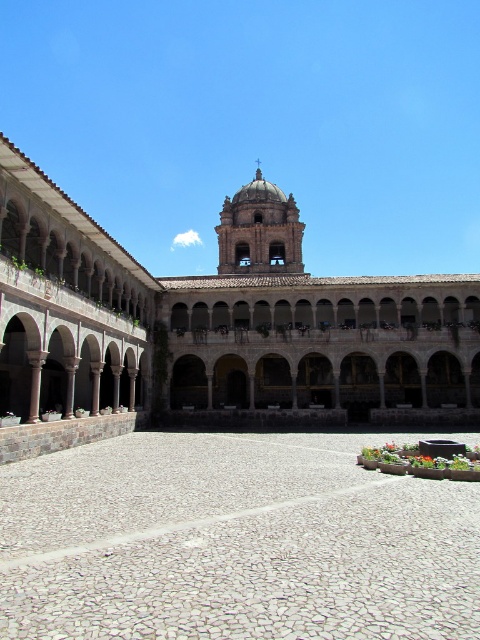
You are standing in the courtyard and want to take a photo of the stone arches at center and the white pebble courtyard at center. Which object should you position to the left side of your camera frame to include both in the shot?

To include both the stone arches at center and the white pebble courtyard at center in your camera frame, you should position the white pebble courtyard at center to the left side of your frame since the stone arches at center are located to the right of it.

You are standing in the courtyard and want to take a photo of the stone arches at center and the white pebble courtyard at center. Which one should you focus on first to ensure both are in the frame?

You should focus on the stone arches at center first because they are closer to you than the white pebble courtyard at center, ensuring both are in the frame.